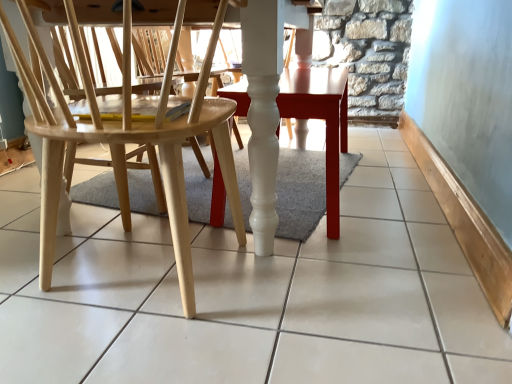
The height and width of the screenshot is (384, 512). What are the coordinates of `free space to the right of white glossy table at center` in the screenshot? It's located at (388, 177).